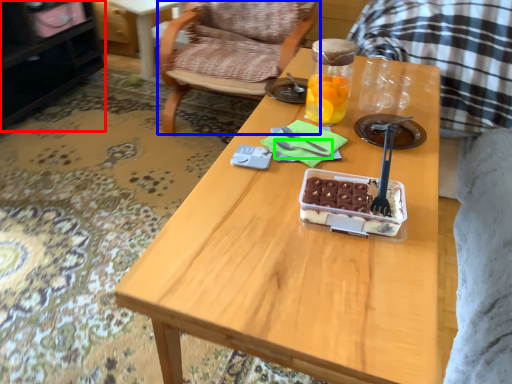
Question: Estimate the real-world distances between objects in this image. Which object is farther from cabinetry (highlighted by a red box), chair (highlighted by a blue box) or fork (highlighted by a green box)?

Choices:
 (A) chair
 (B) fork

Answer: (B)